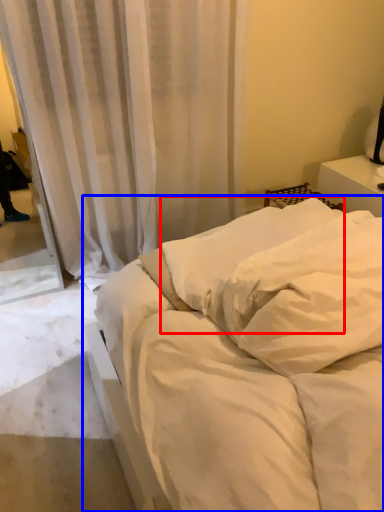
Question: Among these objects, which one is nearest to the camera, pillow (highlighted by a red box) or bed (highlighted by a blue box)?

Choices:
 (A) pillow
 (B) bed

Answer: (B)